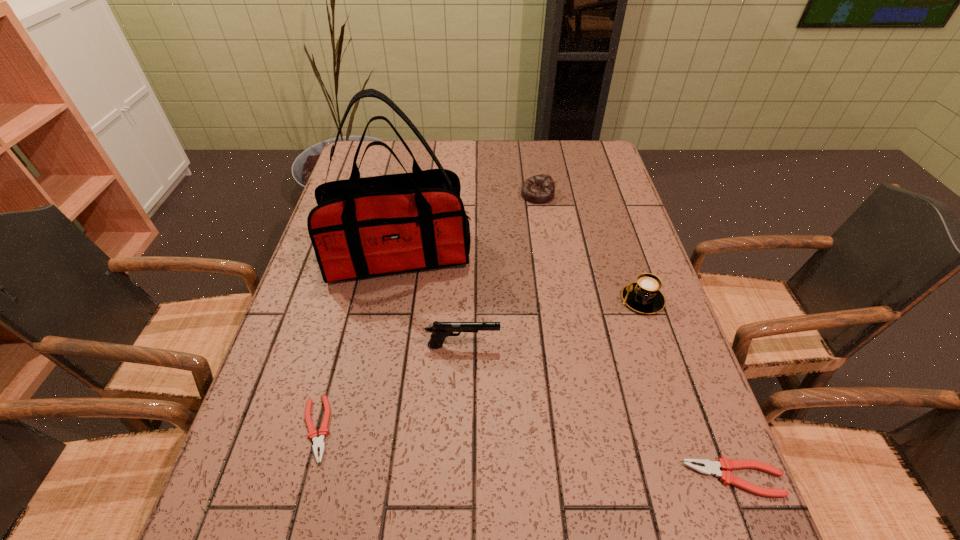
Find the location of `free space located 0.110m on the right of the left pliers`. free space located 0.110m on the right of the left pliers is located at coordinates (387, 429).

This screenshot has width=960, height=540. What are the coordinates of `blank space located 0.340m on the back of the right pliers` in the screenshot? It's located at (672, 317).

Locate an element on the screen. This screenshot has height=540, width=960. vacant area situated on the right of the third shortest object is located at coordinates (586, 194).

At what (x,y) coordinates should I click in order to perform the action: click on free space located at the aiming end of the gun. Please return your answer as a coordinate pair (x, y). The height and width of the screenshot is (540, 960). Looking at the image, I should click on (556, 346).

Where is `free space located 0.340m on the left of the third tallest object`? The height and width of the screenshot is (540, 960). free space located 0.340m on the left of the third tallest object is located at coordinates (484, 300).

At what (x,y) coordinates should I click in order to perform the action: click on free space located on the back of the duffel bag. Please return your answer as a coordinate pair (x, y). This screenshot has height=540, width=960. Looking at the image, I should click on pyautogui.click(x=411, y=192).

The image size is (960, 540). Find the location of `pliers present at the left edge`. pliers present at the left edge is located at coordinates (318, 442).

Identify the location of duffel bag located at the left edge. (366, 227).

Identify the location of pliers that is at the right edge. (710, 467).

Where is `cappuccino present at the right edge`? cappuccino present at the right edge is located at coordinates (644, 296).